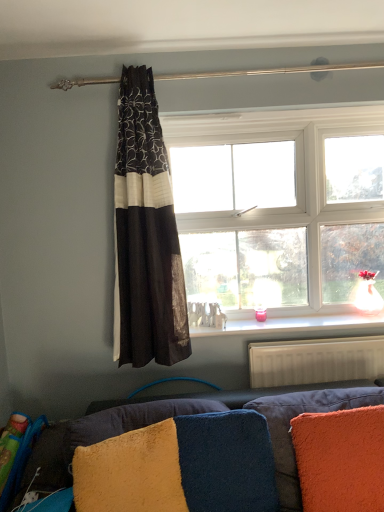
Question: Does fuzzy yellow pillow at lower left, marked as the 1th pillow in a left-to-right arrangement, have a greater width compared to white textured radiator at lower right?

Choices:
 (A) yes
 (B) no

Answer: (A)

Question: Can you confirm if fuzzy yellow pillow at lower left, marked as the 1th pillow in a left-to-right arrangement, is smaller than white textured radiator at lower right?

Choices:
 (A) yes
 (B) no

Answer: (B)

Question: Are fuzzy yellow pillow at lower left, acting as the third pillow starting from the right, and white textured radiator at lower right far apart?

Choices:
 (A) no
 (B) yes

Answer: (A)

Question: Does fuzzy yellow pillow at lower left, acting as the third pillow starting from the right, have a greater height compared to white textured radiator at lower right?

Choices:
 (A) no
 (B) yes

Answer: (B)

Question: Is fuzzy yellow pillow at lower left, marked as the 1th pillow in a left-to-right arrangement, to the left of white textured radiator at lower right from the viewer's perspective?

Choices:
 (A) yes
 (B) no

Answer: (A)

Question: Would you say fuzzy yellow pillow at lower left, marked as the 1th pillow in a left-to-right arrangement, is outside white textured radiator at lower right?

Choices:
 (A) no
 (B) yes

Answer: (B)

Question: Does orange fuzzy pillow at lower right, which is the third pillow in left-to-right order, have a lesser height compared to white glossy window sill at center?

Choices:
 (A) no
 (B) yes

Answer: (A)

Question: Is orange fuzzy pillow at lower right, positioned as the first pillow in right-to-left order, smaller than white glossy window sill at center?

Choices:
 (A) no
 (B) yes

Answer: (A)

Question: Is orange fuzzy pillow at lower right, which is the third pillow in left-to-right order, oriented towards white glossy window sill at center?

Choices:
 (A) yes
 (B) no

Answer: (B)

Question: Is orange fuzzy pillow at lower right, which is the third pillow in left-to-right order, further to the viewer compared to white glossy window sill at center?

Choices:
 (A) yes
 (B) no

Answer: (B)

Question: From a real-world perspective, is orange fuzzy pillow at lower right, which is the third pillow in left-to-right order, located higher than white glossy window sill at center?

Choices:
 (A) yes
 (B) no

Answer: (B)

Question: Is orange fuzzy pillow at lower right, positioned as the first pillow in right-to-left order, positioned with its back to white glossy window sill at center?

Choices:
 (A) no
 (B) yes

Answer: (B)

Question: Is black sheer curtain at center next to orange fuzzy pillow at lower right, positioned as the first pillow in right-to-left order?

Choices:
 (A) yes
 (B) no

Answer: (B)